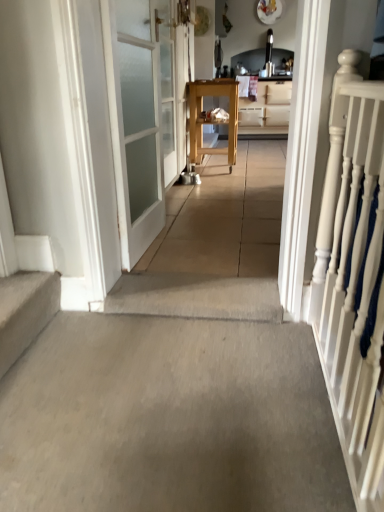
What do you see at coordinates (135, 122) in the screenshot? The width and height of the screenshot is (384, 512). I see `white frosted glass door at left, which ranks as the 2th door in back-to-front order` at bounding box center [135, 122].

What are the coordinates of `white painted wood railing at right` in the screenshot? It's located at (354, 276).

What is the approximate height of white painted wood railing at right?

white painted wood railing at right is 4.67 feet in height.

This screenshot has height=512, width=384. In order to click on wooden cart at center in this screenshot , I will do `click(210, 119)`.

Image resolution: width=384 pixels, height=512 pixels. What do you see at coordinates (172, 86) in the screenshot?
I see `clear glass door at center, the 1th door from the back` at bounding box center [172, 86].

Measure the distance between point (x=269, y=110) and camera.

Point (x=269, y=110) and camera are 5.63 meters apart.

The image size is (384, 512). In order to click on gray concrete at center in this screenshot , I will do `click(169, 418)`.

Can you confirm if white frosted glass door at left, arranged as the 1th door when viewed from the front, is positioned to the right of carpeted stairs at lower left?

Yes, white frosted glass door at left, arranged as the 1th door when viewed from the front, is to the right of carpeted stairs at lower left.

Measure the distance between white frosted glass door at left, arranged as the 1th door when viewed from the front, and carpeted stairs at lower left.

white frosted glass door at left, arranged as the 1th door when viewed from the front, is 26.03 inches from carpeted stairs at lower left.

Between white frosted glass door at left, which ranks as the 2th door in back-to-front order, and carpeted stairs at lower left, which one has larger size?

white frosted glass door at left, which ranks as the 2th door in back-to-front order, is bigger.

Considering the positions of point (149, 159) and point (21, 278), is point (149, 159) closer or farther from the camera than point (21, 278)?

Clearly, point (149, 159) is more distant from the camera than point (21, 278).

Is wooden cart at center positioned with its back to gray concrete at center?

That's not correct — wooden cart at center is not looking away from gray concrete at center.

How different are the orientations of wooden cart at center and gray concrete at center in degrees?

1.17 degrees.

Does wooden cart at center have a greater height compared to gray concrete at center?

Indeed, wooden cart at center has a greater height compared to gray concrete at center.

Is wooden cart at center bigger than gray concrete at center?

Yes.

Could you measure the distance between white frosted glass door at left, which ranks as the 2th door in back-to-front order, and carpet at center?

A distance of 25.33 inches exists between white frosted glass door at left, which ranks as the 2th door in back-to-front order, and carpet at center.

From the image's perspective, is white frosted glass door at left, arranged as the 1th door when viewed from the front, beneath carpet at center?

Yes, from the image's perspective, white frosted glass door at left, arranged as the 1th door when viewed from the front, is below carpet at center.

Visually, is white frosted glass door at left, which ranks as the 2th door in back-to-front order, positioned to the left or to the right of carpet at center?

white frosted glass door at left, which ranks as the 2th door in back-to-front order, is to the left of carpet at center.

Can you confirm if white frosted glass door at left, which ranks as the 2th door in back-to-front order, is taller than carpet at center?

Indeed, white frosted glass door at left, which ranks as the 2th door in back-to-front order, has a greater height compared to carpet at center.

Is carpet at center not close to white frosted glass door at left, arranged as the 1th door when viewed from the front?

No, carpet at center is in close proximity to white frosted glass door at left, arranged as the 1th door when viewed from the front.

Can you confirm if carpet at center is bigger than white frosted glass door at left, which ranks as the 2th door in back-to-front order?

Yes.

Is carpet at center thinner than white frosted glass door at left, arranged as the 1th door when viewed from the front?

No, carpet at center is not thinner than white frosted glass door at left, arranged as the 1th door when viewed from the front.

Is carpet at center facing away from white frosted glass door at left, which ranks as the 2th door in back-to-front order?

No, white frosted glass door at left, which ranks as the 2th door in back-to-front order, is not at the back of carpet at center.

Is gray concrete at center turned away from white frosted glass door at left, arranged as the 1th door when viewed from the front?

gray concrete at center is not turned away from white frosted glass door at left, arranged as the 1th door when viewed from the front.

Is gray concrete at center far from white frosted glass door at left, arranged as the 1th door when viewed from the front?

Actually, gray concrete at center and white frosted glass door at left, arranged as the 1th door when viewed from the front, are a little close together.

From the gray concrete at center, count 1st doors backward and point to it. Please provide its 2D coordinates.

[(135, 122)]

Considering the relative positions of gray concrete at center and white frosted glass door at left, which ranks as the 2th door in back-to-front order, in the image provided, is gray concrete at center in front of white frosted glass door at left, which ranks as the 2th door in back-to-front order,?

That is True.

Is white frosted glass door at left, arranged as the 1th door when viewed from the front, positioned far away from wooden cart at center?

white frosted glass door at left, arranged as the 1th door when viewed from the front, is far away from wooden cart at center.

Between white frosted glass door at left, which ranks as the 2th door in back-to-front order, and wooden cart at center, which one is positioned behind?

Positioned behind is wooden cart at center.

Can you tell me how much white frosted glass door at left, arranged as the 1th door when viewed from the front, and wooden cart at center differ in facing direction?

The facing directions of white frosted glass door at left, arranged as the 1th door when viewed from the front, and wooden cart at center are 2.24 degrees apart.

Which object is thinner, white frosted glass door at left, arranged as the 1th door when viewed from the front, or wooden cart at center?

white frosted glass door at left, arranged as the 1th door when viewed from the front, is thinner.

Is wooden cart at center taller or shorter than white painted wood railing at right?

Considering their sizes, wooden cart at center has less height than white painted wood railing at right.

Is wooden cart at center not near white painted wood railing at right?

Yes, wooden cart at center and white painted wood railing at right are quite far apart.

Is wooden cart at center behind white painted wood railing at right?

That is True.

From the image's perspective, is wooden cart at center below white painted wood railing at right?

No.

Identify the location of stairs lying in front of the white frosted glass door at left, which ranks as the 2th door in back-to-front order. This screenshot has height=512, width=384. (25, 311).

This screenshot has width=384, height=512. Find the location of `furniture that is above the gray concrete at center (from a real-world perspective)`. furniture that is above the gray concrete at center (from a real-world perspective) is located at coordinates (210, 119).

Looking at the image, which one is located further to wooden cart at center, carpet at center or wooden cabinet at center?

wooden cabinet at center lies further to wooden cart at center than the other object.

From the image, which object appears to be farther from white painted wood railing at right, carpet at center or wooden cart at center?

Based on the image, wooden cart at center appears to be further to white painted wood railing at right.

Estimate the real-world distances between objects in this image. Which object is further from carpet at center, gray concrete at center or carpeted stairs at lower left?

gray concrete at center lies further to carpet at center than the other object.

Which object lies nearer to the anchor point white frosted glass door at left, arranged as the 1th door when viewed from the front, clear glass door at center, marked as the 2th door in a front-to-back arrangement, or gray concrete at center?

gray concrete at center is positioned closer to the anchor white frosted glass door at left, arranged as the 1th door when viewed from the front.

Estimate the real-world distances between objects in this image. Which object is closer to carpeted stairs at lower left, white frosted glass door at left, which ranks as the 2th door in back-to-front order, or carpet at center?

The object closer to carpeted stairs at lower left is white frosted glass door at left, which ranks as the 2th door in back-to-front order.

Considering their positions, is white painted wood railing at right positioned further to gray concrete at center than clear glass door at center, marked as the 2th door in a front-to-back arrangement?

clear glass door at center, marked as the 2th door in a front-to-back arrangement.

From the image, which object appears to be farther from carpeted stairs at lower left, clear glass door at center, the 1th door from the back, or white frosted glass door at left, arranged as the 1th door when viewed from the front?

Based on the image, clear glass door at center, the 1th door from the back, appears to be further to carpeted stairs at lower left.

Which object lies nearer to the anchor point wooden cabinet at center, wooden cart at center or white painted wood railing at right?

wooden cart at center is closer to wooden cabinet at center.

In order to click on door positioned between carpet at center and wooden cart at center from near to far in this screenshot , I will do `click(172, 86)`.

Find the location of a particular element. Image resolution: width=384 pixels, height=512 pixels. stairs positioned between gray concrete at center and wooden cart at center from near to far is located at coordinates (25, 311).

Identify the location of door between white frosted glass door at left, which ranks as the 2th door in back-to-front order, and wooden cabinet at center from front to back. (172, 86).

This screenshot has width=384, height=512. What are the coordinates of `path between carpeted stairs at lower left and wooden cabinet at center in the front-back direction` in the screenshot? It's located at (215, 245).